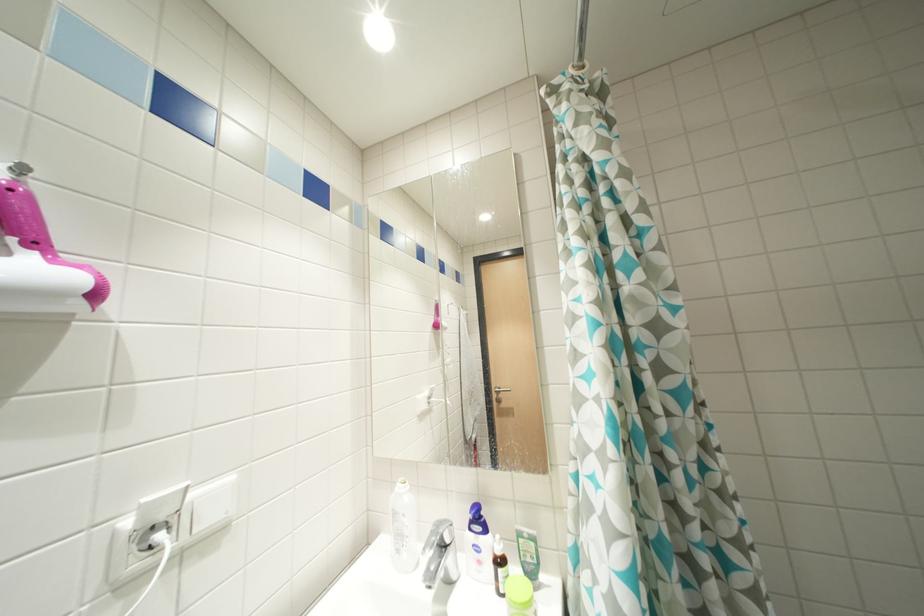
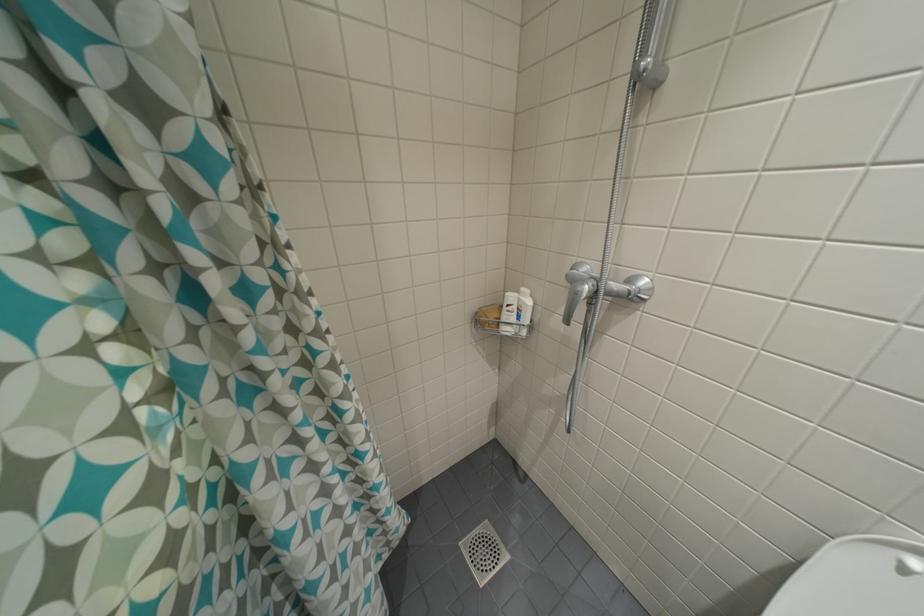
The first image is from the beginning of the video and the second image is from the end. How did the camera likely rotate when shooting the video?

The camera rotated toward right-down.